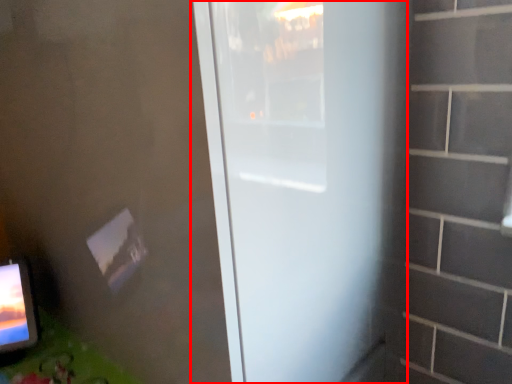
Question: From the image's perspective, what is the correct spatial positioning of door (annotated by the red box) in reference to table?

Choices:
 (A) above
 (B) below

Answer: (A)